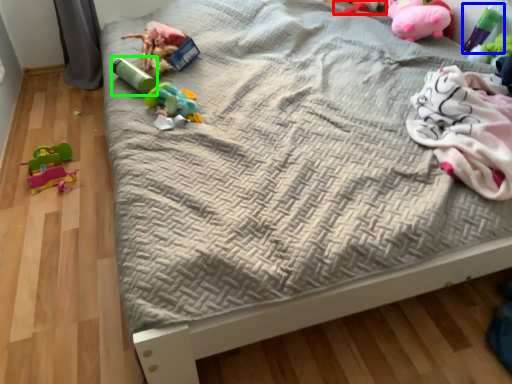
Question: Which is farther away from toy (highlighted by a red box)? toy (highlighted by a blue box) or toy (highlighted by a green box)?

Choices:
 (A) toy
 (B) toy

Answer: (B)